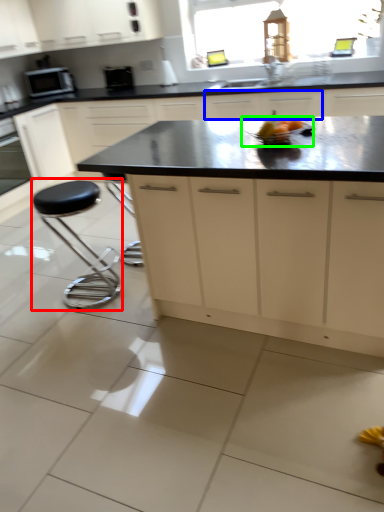
Question: Considering the real-world distances, which object is closest to stool (highlighted by a red box)? cabinetry (highlighted by a blue box) or appliance (highlighted by a green box).

Choices:
 (A) cabinetry
 (B) appliance

Answer: (B)